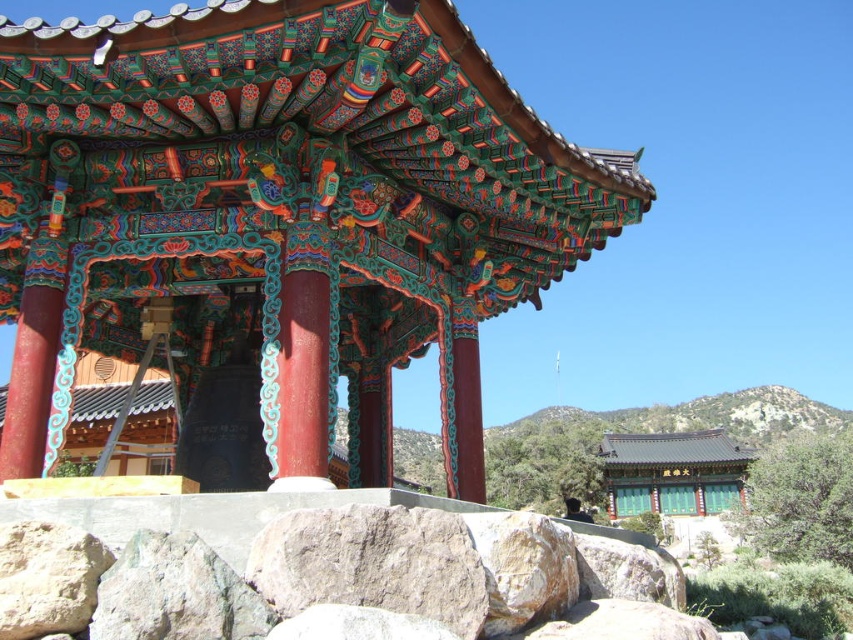
You are standing in front of the polychrome wood gazebo at center and the gray rough rock at lower center. Which object is located to the right side?

The gray rough rock at lower center is located to the right side of the polychrome wood gazebo at center.

You are a visitor standing in front of the polychrome wood gazebo at center and the gray rough rock at lower center. If you want to take a photo that includes both objects, which one should you position closer to the camera to ensure both are fully visible in the frame?

The polychrome wood gazebo at center might be wider than gray rough rock at lower center, so positioning the gazebo closer to the camera would help keep both objects within the frame by adjusting their relative sizes appropriately.